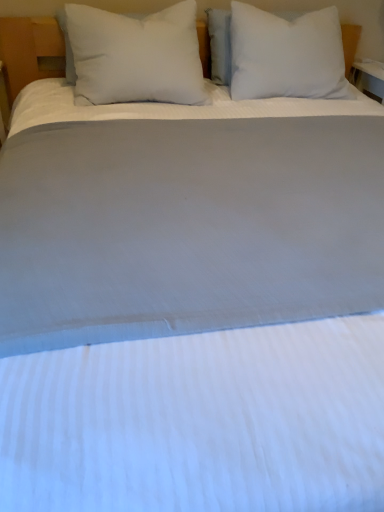
Question: Is white soft pillow at upper center, which is counted as the 1th pillow, starting from the right, spatially inside white soft pillow at left, the 1th pillow positioned from the left, or outside of it?

Choices:
 (A) outside
 (B) inside

Answer: (A)

Question: Considering the positions of white soft pillow at upper center, the second pillow in the left-to-right sequence, and white soft pillow at left, acting as the second pillow starting from the right, in the image, is white soft pillow at upper center, the second pillow in the left-to-right sequence, bigger or smaller than white soft pillow at left, acting as the second pillow starting from the right,?

Choices:
 (A) big
 (B) small

Answer: (A)

Question: Considering the positions of white soft pillow at upper center, the second pillow in the left-to-right sequence, and white soft pillow at left, acting as the second pillow starting from the right, in the image, is white soft pillow at upper center, the second pillow in the left-to-right sequence, taller or shorter than white soft pillow at left, acting as the second pillow starting from the right,?

Choices:
 (A) short
 (B) tall

Answer: (B)

Question: From a real-world perspective, is white soft pillow at left, acting as the second pillow starting from the right, above or below white soft pillow at upper center, the second pillow in the left-to-right sequence?

Choices:
 (A) below
 (B) above

Answer: (B)

Question: Looking at the image, does white soft pillow at left, the 1th pillow positioned from the left, seem bigger or smaller compared to white soft pillow at upper center, the second pillow in the left-to-right sequence?

Choices:
 (A) big
 (B) small

Answer: (B)

Question: From the image's perspective, is white soft pillow at left, acting as the second pillow starting from the right, positioned above or below white soft pillow at upper center, which is counted as the 1th pillow, starting from the right?

Choices:
 (A) above
 (B) below

Answer: (B)

Question: In the image, is white soft pillow at left, the 1th pillow positioned from the left, on the left side or the right side of white soft pillow at upper center, which is counted as the 1th pillow, starting from the right?

Choices:
 (A) right
 (B) left

Answer: (B)